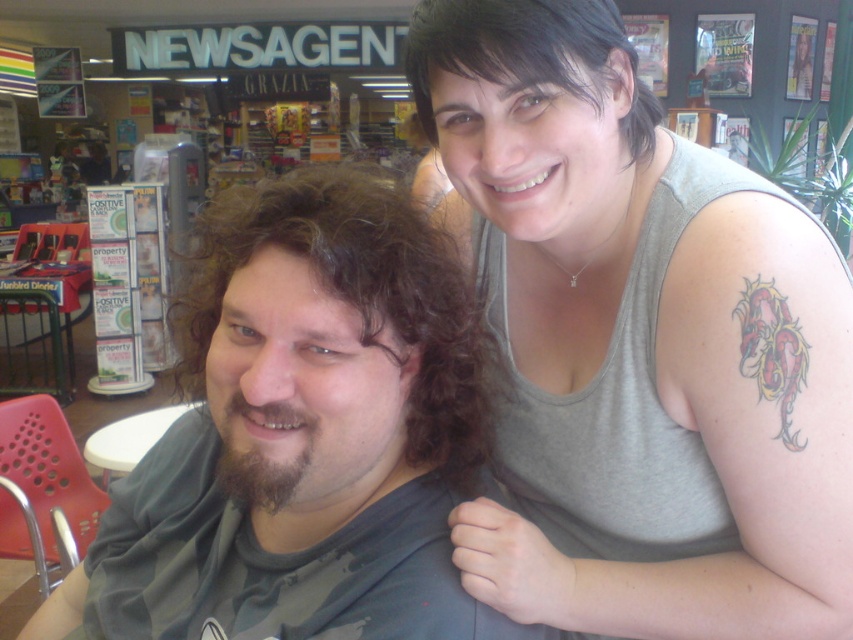
Who is more forward, (178,388) or (596,65)?

Positioned in front is point (596,65).

This screenshot has height=640, width=853. What do you see at coordinates (358, 300) in the screenshot?
I see `dark curly hair at left` at bounding box center [358, 300].

Find the location of a particular element. dark curly hair at left is located at coordinates (358, 300).

Who is positioned more to the right, gray matte shirt at center or dark curly hair at left?

From the viewer's perspective, dark curly hair at left appears more on the right side.

Is point (283, 465) positioned behind point (415, 228)?

That is False.

Image resolution: width=853 pixels, height=640 pixels. What are the coordinates of `gray matte shirt at center` in the screenshot? It's located at (305, 438).

Does gray matte shirt at center have a lesser width compared to black matte hair at upper center?

Incorrect, gray matte shirt at center's width is not less than black matte hair at upper center's.

Can you confirm if gray matte shirt at center is positioned above black matte hair at upper center?

Incorrect, gray matte shirt at center is not positioned above black matte hair at upper center.

Which is behind, point (241, 301) or point (483, 12)?

The point (483, 12) is more distant.

What are the coordinates of `gray matte shirt at center` in the screenshot? It's located at (305, 438).